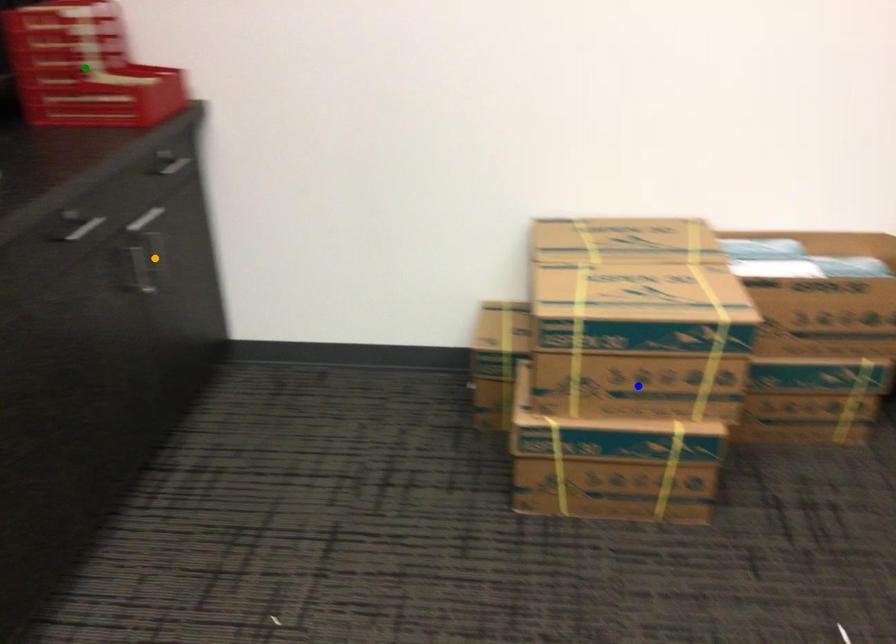
Order these from nearest to farthest:
A) orange point
B) green point
C) blue point

1. blue point
2. orange point
3. green point